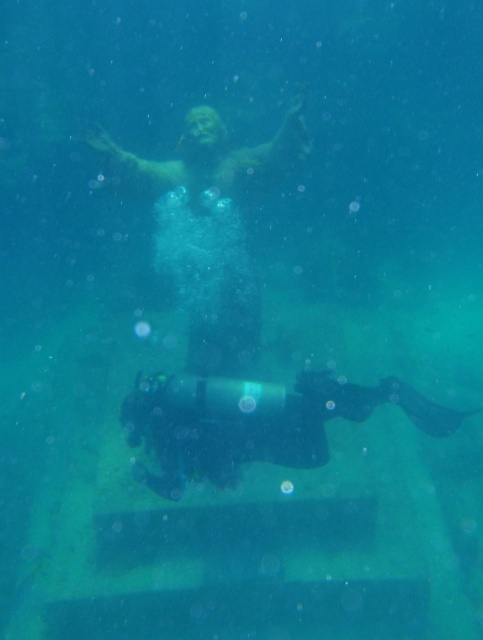
You are a scuba diver swimming in the underwater scene. You see the point marked at coordinate (211, 230). What object does this point correspond to?

The point at coordinate (211, 230) corresponds to the matte bronze statue at center.

You are a marine biologist studying underwater sculptures. You notice the matte bronze statue at center and the black matte scuba diver at lower center. Which object has a smaller width when viewed from above?

The matte bronze statue at center is thinner than the black matte scuba diver at lower center, so the matte bronze statue at center has a smaller width when viewed from above.

You are a scuba diver who wants to take a photo of the matte bronze statue at center. Your camera has a maximum focus range of 15 feet. Can you capture the statue clearly without moving closer?

The matte bronze statue at center is 14.04 feet away from the camera. Since your camera can focus up to 15 feet, you can capture the statue clearly without moving closer.